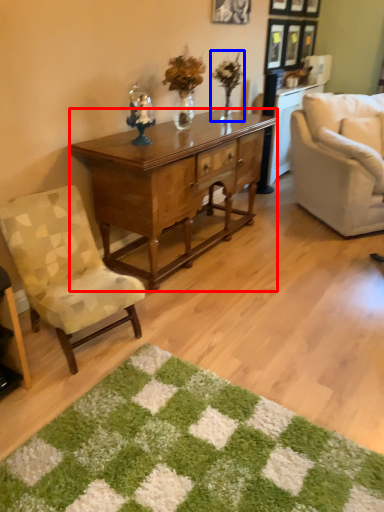
Question: Which object is further to the camera taking this photo, desk (highlighted by a red box) or houseplant (highlighted by a blue box)?

Choices:
 (A) desk
 (B) houseplant

Answer: (B)